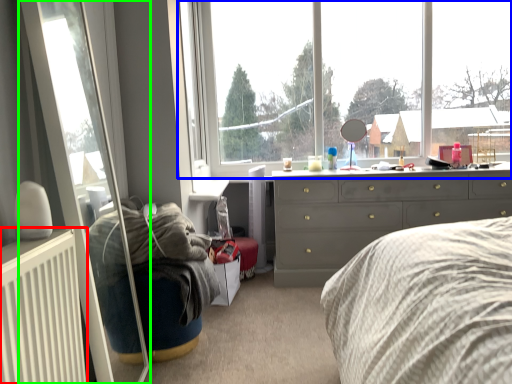
Question: Which object is the farthest from radiator (highlighted by a red box)? Choose among these: window (highlighted by a blue box) or glass door (highlighted by a green box).

Choices:
 (A) window
 (B) glass door

Answer: (A)